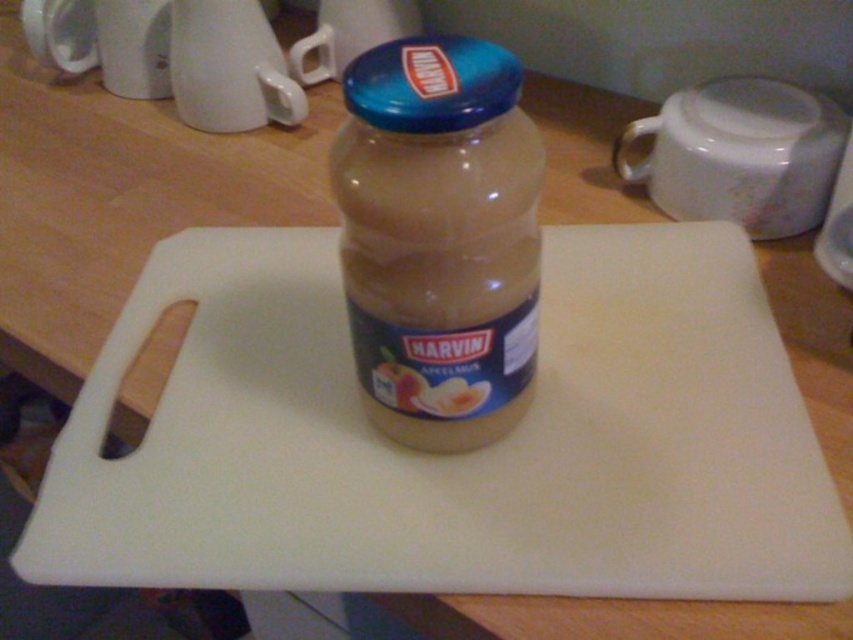
Between translucent glass jar at center and white glossy mug at upper right, which one is positioned lower?

Positioned lower is translucent glass jar at center.

Is translucent glass jar at center wider than white glossy mug at upper right?

No.

What do you see at coordinates (439, 237) in the screenshot? I see `translucent glass jar at center` at bounding box center [439, 237].

This screenshot has height=640, width=853. In order to click on translucent glass jar at center in this screenshot , I will do `click(439, 237)`.

Is blue metallic lid at center taller than matte plastic jar at center?

Yes.

Does point (483, 61) come farther from viewer compared to point (456, 413)?

No, (483, 61) is closer to viewer.

Who is more forward, (497, 86) or (364, 365)?

Point (497, 86)

This screenshot has height=640, width=853. What are the coordinates of `blue metallic lid at center` in the screenshot? It's located at (431, 83).

Does white glossy mug at upper right have a larger size compared to blue metallic lid at center?

Indeed, white glossy mug at upper right has a larger size compared to blue metallic lid at center.

Does point (822, 125) come in front of point (404, 104)?

No.

Where is `white glossy mug at upper right`? white glossy mug at upper right is located at coordinates (740, 154).